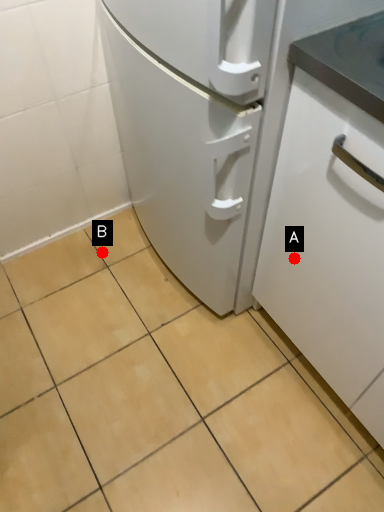
Question: Two points are circled on the image, labeled by A and B beside each circle. Which point is farther from the camera taking this photo?

Choices:
 (A) A is further
 (B) B is further

Answer: (B)